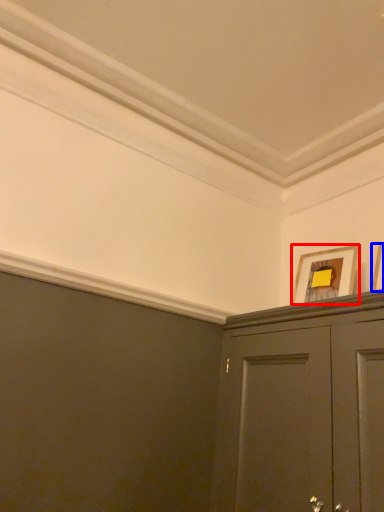
Question: Among these objects, which one is nearest to the camera, picture frame (highlighted by a red box) or picture frame (highlighted by a blue box)?

Choices:
 (A) picture frame
 (B) picture frame

Answer: (B)